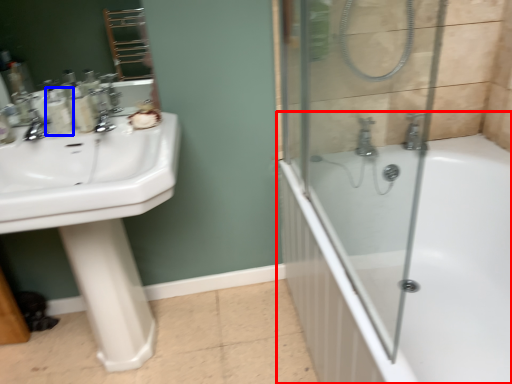
Question: Which object appears farthest to the camera in this image, bathtub (highlighted by a red box) or toiletry (highlighted by a blue box)?

Choices:
 (A) bathtub
 (B) toiletry

Answer: (B)